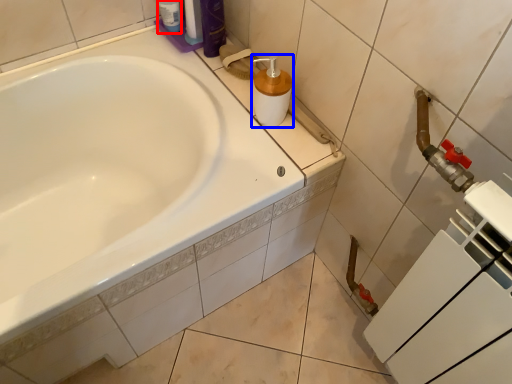
Question: Among these objects, which one is farthest to the camera, toiletry (highlighted by a red box) or soap dispenser (highlighted by a blue box)?

Choices:
 (A) toiletry
 (B) soap dispenser

Answer: (A)